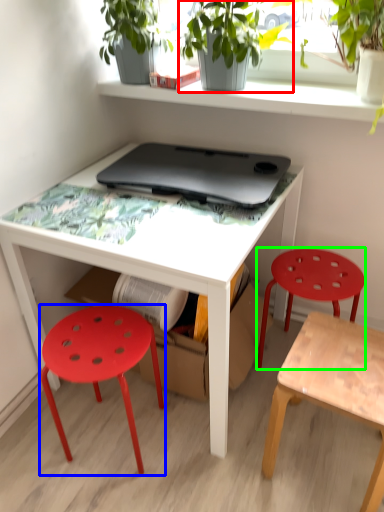
Question: Based on their relative distances, which object is farther from houseplant (highlighted by a red box)? Choose from stool (highlighted by a blue box) and stool (highlighted by a green box).

Choices:
 (A) stool
 (B) stool

Answer: (A)